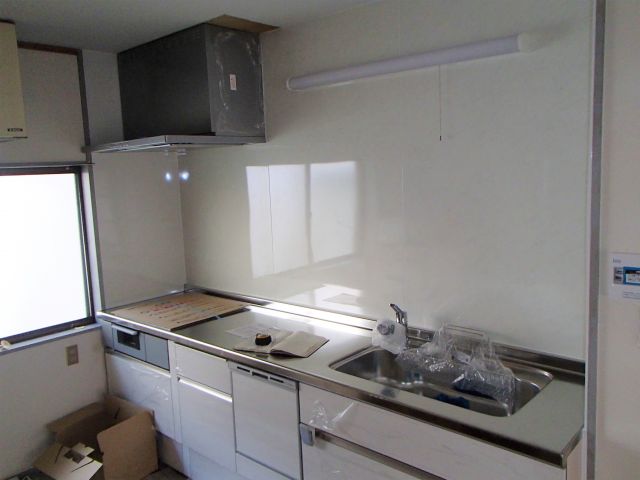
This screenshot has height=480, width=640. In order to click on metallic sink basin in this screenshot , I will do `click(380, 371)`.